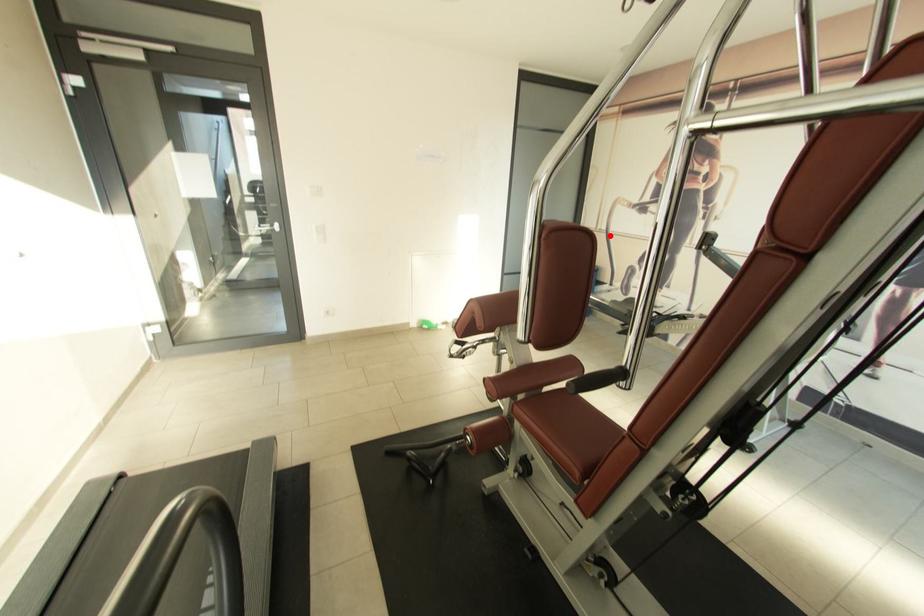
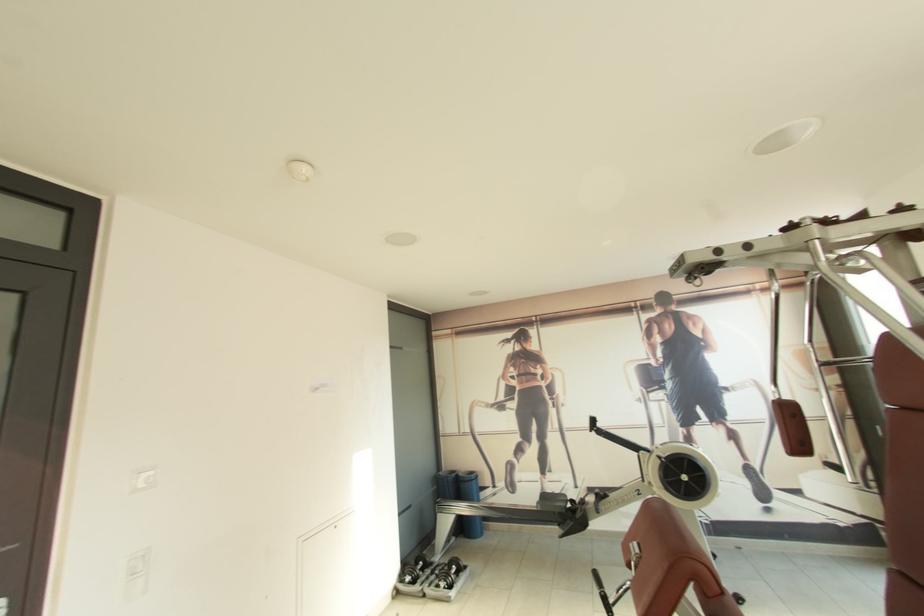
Find the pixel in the second image that matches the highlighted location in the first image.

(476, 438)